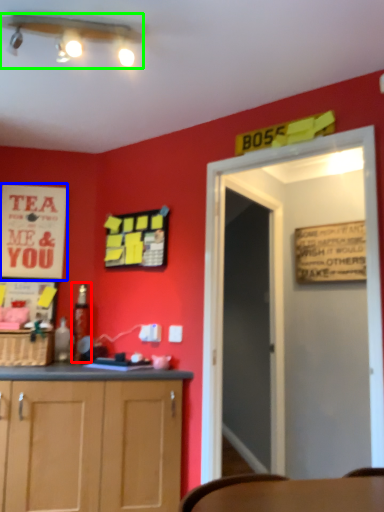
Question: Which object is positioned farthest from bottle (highlighted by a red box)? Select from poster (highlighted by a blue box) and light fixture (highlighted by a green box).

Choices:
 (A) poster
 (B) light fixture

Answer: (B)